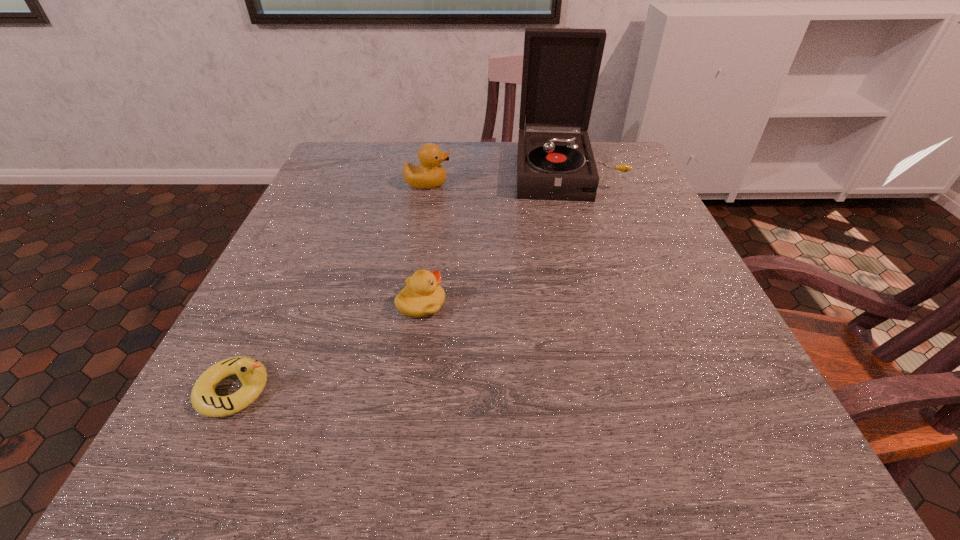
You are a GUI agent. You are given a task and a screenshot of the screen. Output one action in this format:
    pyautogui.click(x=<x>, y=<y>)
    Task: Click on the tallest object
    
    Given the screenshot: What is the action you would take?
    pyautogui.click(x=561, y=66)

At what (x,y) coordinates should I click in order to perform the action: click on the rightmost object. Please return your answer as a coordinate pair (x, y). This screenshot has height=540, width=960. Looking at the image, I should click on (561, 66).

Image resolution: width=960 pixels, height=540 pixels. I want to click on the third shortest object, so click(430, 174).

Locate an element on the screen. The height and width of the screenshot is (540, 960). the tallest duckling is located at coordinates (430, 174).

In order to click on the third farthest object in this screenshot , I will do `click(422, 296)`.

Find the location of a particular element. Image resolution: width=960 pixels, height=540 pixels. the leftmost duckling is located at coordinates (251, 372).

The height and width of the screenshot is (540, 960). Find the location of `the leftmost object`. the leftmost object is located at coordinates [x=251, y=372].

Where is `vacant space situated on the left of the rightmost object`? This screenshot has width=960, height=540. vacant space situated on the left of the rightmost object is located at coordinates (397, 172).

What are the coordinates of `vacant area situated on the face of the farthest duckling` in the screenshot? It's located at (547, 184).

Identify the location of free location located on the front-facing side of the third farthest object. The image size is (960, 540). (486, 304).